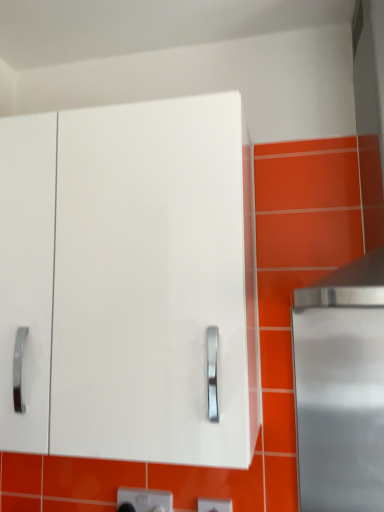
Question: Relative to white glossy cabinet at center, is white plastic electric outlet at lower center, which appears as the 1th electric outlet when viewed from the back, in front or behind?

Choices:
 (A) behind
 (B) front

Answer: (A)

Question: From a real-world perspective, is white plastic electric outlet at lower center, positioned as the 2th electric outlet in right-to-left order, above or below white glossy cabinet at center?

Choices:
 (A) below
 (B) above

Answer: (A)

Question: Which object is positioned farthest from the white glossy cabinet at center?

Choices:
 (A) white plastic electric outlet at lower center, which is counted as the first electric outlet, starting from the right
 (B) white plastic electric outlet at lower center, which appears as the 1th electric outlet when viewed from the back

Answer: (A)

Question: Estimate the real-world distances between objects in this image. Which object is farther from the white plastic electric outlet at lower center, the 2th electric outlet from the back?

Choices:
 (A) white plastic electric outlet at lower center, which is counted as the 1th electric outlet, starting from the left
 (B) white glossy cabinet at center

Answer: (B)